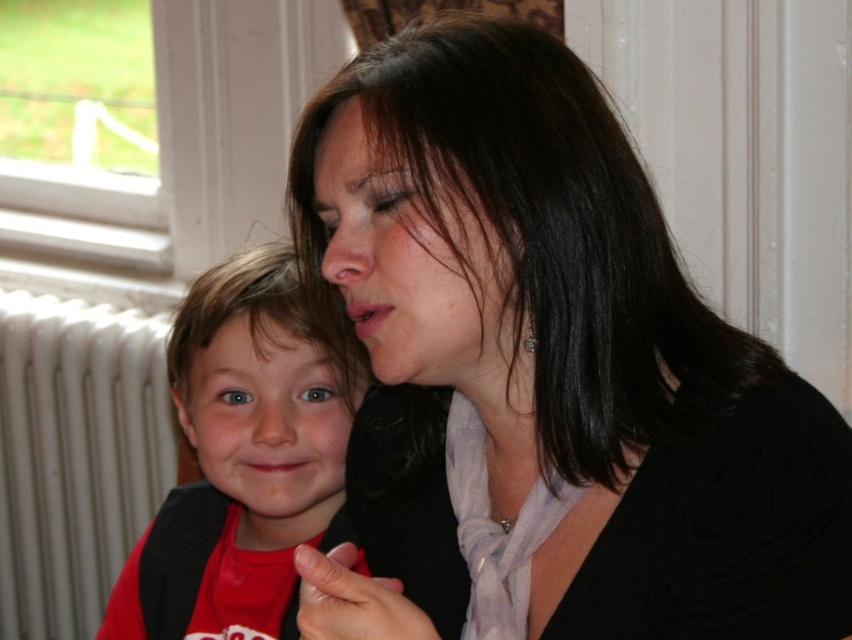
Who is taller, red shirt at center or white metallic radiator at left?

Standing taller between the two is white metallic radiator at left.

Where is `red shirt at center`? This screenshot has width=852, height=640. red shirt at center is located at coordinates (x=242, y=458).

The image size is (852, 640). I want to click on red shirt at center, so click(242, 458).

Is black matte scarf at center below red shirt at center?

Incorrect, black matte scarf at center is not positioned below red shirt at center.

Does black matte scarf at center have a smaller size compared to red shirt at center?

No, black matte scarf at center is not smaller than red shirt at center.

Is point (346, 589) less distant than point (285, 314)?

Yes, it is in front of point (285, 314).

Image resolution: width=852 pixels, height=640 pixels. What are the coordinates of `black matte scarf at center` in the screenshot? It's located at (544, 372).

Where is `black matte scarf at center`? The height and width of the screenshot is (640, 852). black matte scarf at center is located at coordinates (544, 372).

Is point (688, 355) behind point (131, 324)?

No.

Between point (423, 209) and point (22, 618), which one is positioned behind?

The point (22, 618) is more distant.

You are a GUI agent. You are given a task and a screenshot of the screen. Output one action in this format:
    pyautogui.click(x=<x>, y=<y>)
    Task: Click on the black matte scarf at center
    
    Given the screenshot: What is the action you would take?
    pyautogui.click(x=544, y=372)